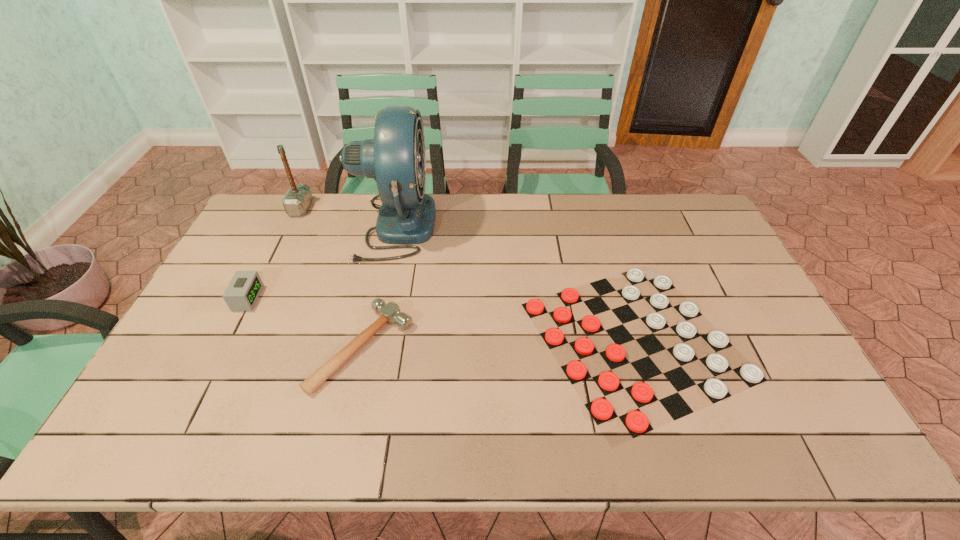
I want to click on free space located on the front-facing side of the third shortest object, so click(x=363, y=298).

At what (x,y) coordinates should I click in order to perform the action: click on vacant area situated on the left of the fourth tallest object. Please return your answer as a coordinate pair (x, y). Looking at the image, I should click on (236, 347).

Identify the location of free space located 0.180m on the left of the shortest object. (458, 340).

Image resolution: width=960 pixels, height=540 pixels. Find the location of `fan positioned at the far edge`. fan positioned at the far edge is located at coordinates (396, 158).

Where is `hammer located in the far edge section of the desktop`? The width and height of the screenshot is (960, 540). hammer located in the far edge section of the desktop is located at coordinates (298, 197).

This screenshot has height=540, width=960. Find the location of `object at the near edge`. object at the near edge is located at coordinates (601, 410).

Image resolution: width=960 pixels, height=540 pixels. Find the location of `hammer that is at the left edge`. hammer that is at the left edge is located at coordinates pos(298,197).

Image resolution: width=960 pixels, height=540 pixels. In order to click on alarm clock that is at the left edge in this screenshot , I will do `click(241, 294)`.

Identify the location of object situated at the right edge. (601, 410).

Where is `object located in the far left corner section of the desktop`? This screenshot has height=540, width=960. object located in the far left corner section of the desktop is located at coordinates (298, 197).